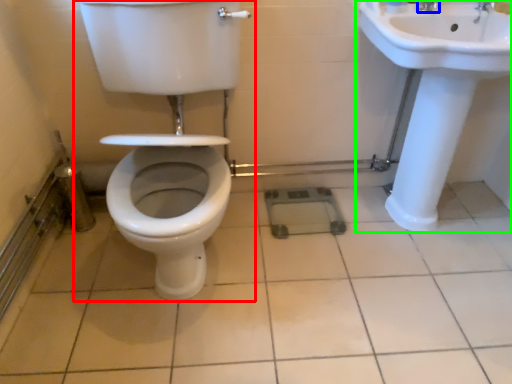
Question: Estimate the real-world distances between objects in this image. Which object is closer to toilet (highlighted by a red box), tap (highlighted by a blue box) or sink (highlighted by a green box)?

Choices:
 (A) tap
 (B) sink

Answer: (B)